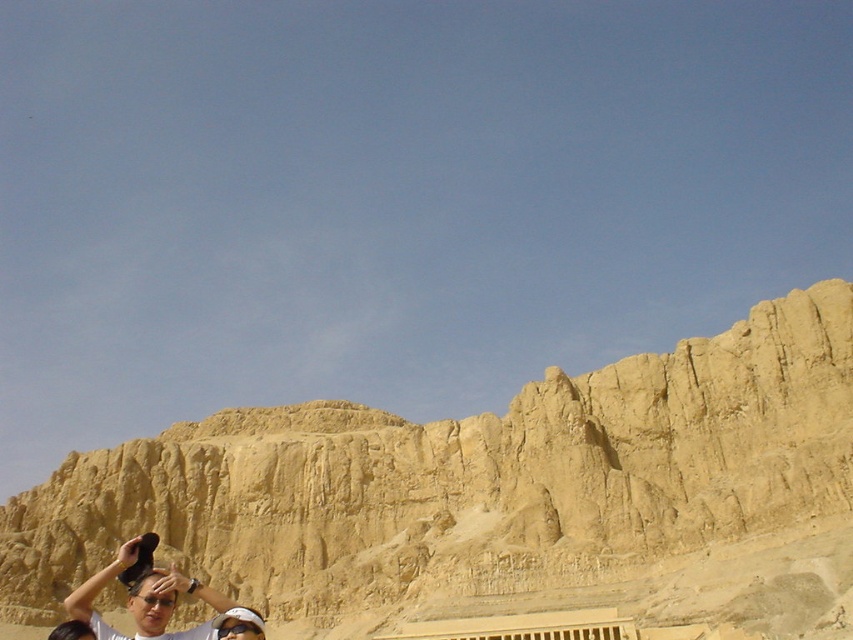
Who is shorter, yellow sandstone cliff at center or matte black goggles at lower center?

matte black goggles at lower center

Measure the distance between yellow sandstone cliff at center and camera.

The distance of yellow sandstone cliff at center from camera is 76.71 meters.

Describe the element at coordinates (467, 480) in the screenshot. I see `yellow sandstone cliff at center` at that location.

Find the location of a particular element. yellow sandstone cliff at center is located at coordinates (467, 480).

Is yellow sandstone cliff at center positioned behind matte black hat at lower left?

Yes.

In the scene shown: Who is positioned more to the right, yellow sandstone cliff at center or matte black hat at lower left?

Positioned to the right is yellow sandstone cliff at center.

Is point (537, 413) positioned in front of point (157, 616)?

No, (537, 413) is further to viewer.

Where is `yellow sandstone cliff at center`? The image size is (853, 640). yellow sandstone cliff at center is located at coordinates 467,480.

Does matte black hat at lower left have a lesser width compared to matte black goggles at lower center?

No.

Is point (227, 616) farther from viewer compared to point (241, 637)?

Yes.

Find the location of `matte black hat at lower left`. matte black hat at lower left is located at coordinates (151, 596).